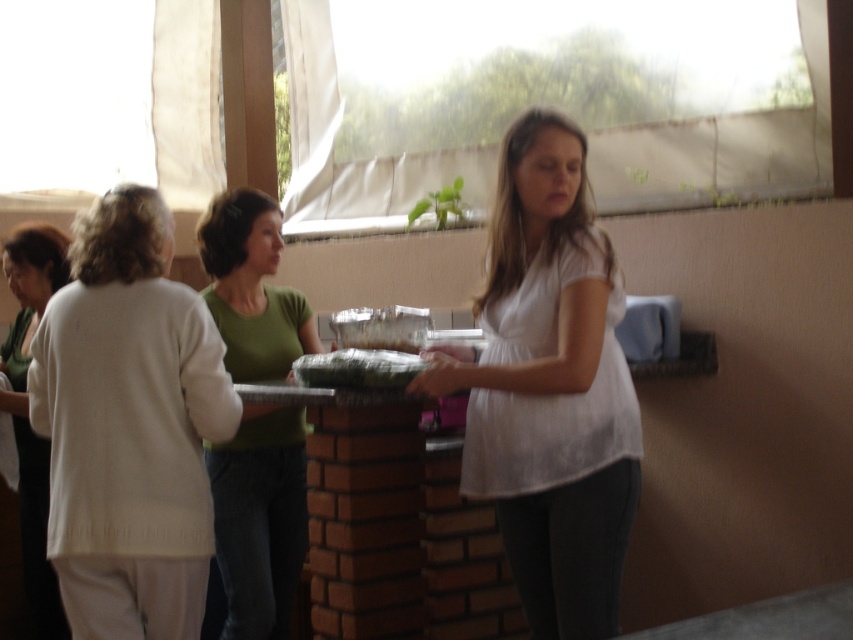
Can you confirm if white knit sweater at left is bigger than green matte food at center?

Indeed, white knit sweater at left has a larger size compared to green matte food at center.

Is point (184, 582) farther from camera compared to point (370, 380)?

No.

At what (x,y) coordinates should I click in order to perform the action: click on white knit sweater at left. Please return your answer as a coordinate pair (x, y). Looking at the image, I should click on tap(129, 426).

Is white matte shirt at center to the left of white sweater at left from the viewer's perspective?

Incorrect, white matte shirt at center is not on the left side of white sweater at left.

Is white matte shirt at center closer to camera compared to white sweater at left?

That is True.

Is point (556, 125) closer to camera compared to point (25, 269)?

That is True.

Identify the location of white matte shirt at center. The width and height of the screenshot is (853, 640). (549, 387).

Measure the distance between green matte shirt at center and white sweater at left.

They are 3.53 feet apart.

Is point (239, 484) farther from camera compared to point (35, 472)?

No, it is not.

At what (x,y) coordinates should I click in order to perform the action: click on green matte shirt at center. Please return your answer as a coordinate pair (x, y). Image resolution: width=853 pixels, height=640 pixels. Looking at the image, I should click on (259, 518).